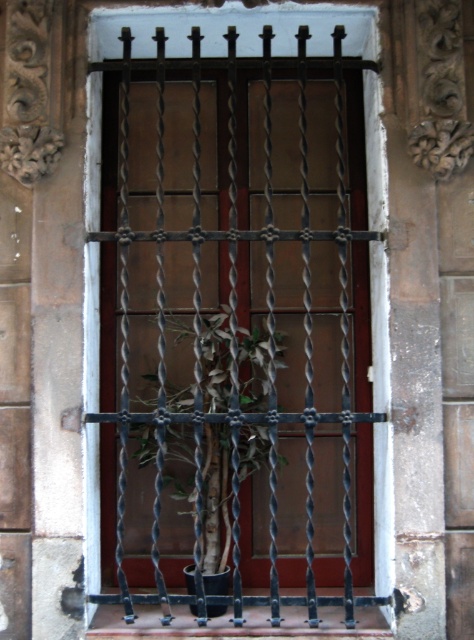
You are a GUI agent. You are given a task and a screenshot of the screen. Output one action in this format:
    pyautogui.click(x=<x>, y=<y>)
    Task: Click on the black wrought iron bars at center
    This screenshot has width=474, height=640.
    Given the screenshot: What is the action you would take?
    pos(235,330)

Where is `black wrought iron bars at center`? The height and width of the screenshot is (640, 474). black wrought iron bars at center is located at coordinates (235, 330).

I want to click on black wrought iron bars at center, so click(235, 330).

Is black wrought iron bars at center thinner than smooth concrete window sill at center?

Indeed, black wrought iron bars at center has a lesser width compared to smooth concrete window sill at center.

Where is `black wrought iron bars at center`? The width and height of the screenshot is (474, 640). black wrought iron bars at center is located at coordinates (235, 330).

Based on the photo, between green leafy plant at center and smooth concrete window sill at center, which one is positioned lower?

smooth concrete window sill at center is below.

From the picture: Can you confirm if green leafy plant at center is smaller than smooth concrete window sill at center?

No.

The height and width of the screenshot is (640, 474). Describe the element at coordinates (204, 486) in the screenshot. I see `green leafy plant at center` at that location.

Identify the location of green leafy plant at center. (204, 486).